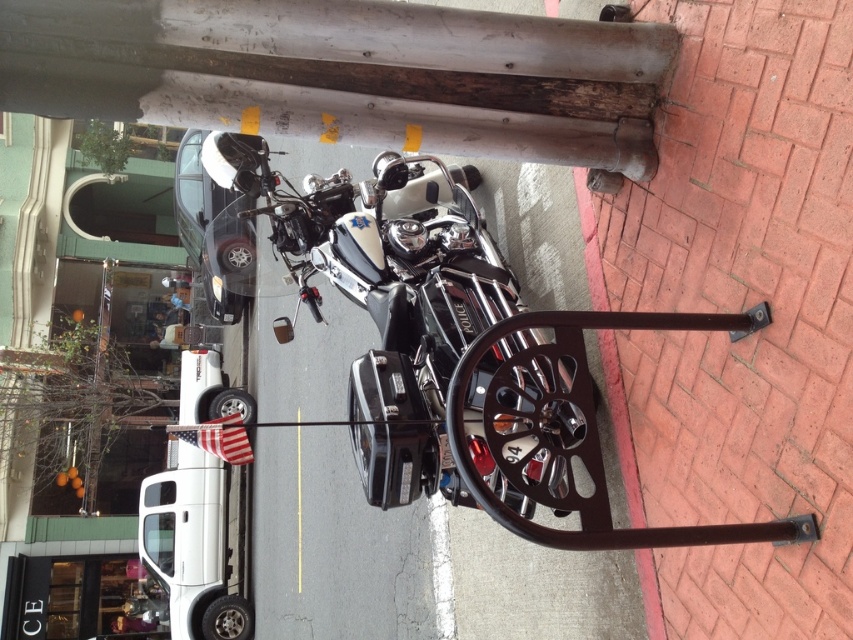
You are standing at the point closest to the motorcycle. Which coordinate point, point A at (x=279, y=237) or point B at (x=627, y=504), is farther away from you?

Point A at (x=279, y=237) is behind point B at (x=627, y=504), so point A is farther away from you.

You are a pedestrian standing on the sidewalk. You see the shiny chrome motorcycle at center and the brick at lower right. Which object is closer to your right side?

The brick at lower right is closer to your right side because it is positioned to the right of the shiny chrome motorcycle at center.

You are a pedestrian standing on the sidewalk and want to cross the street. You see the shiny chrome motorcycle at center and the brick at lower right. Which object is closer to you as you stand on the sidewalk?

The shiny chrome motorcycle at center is closer to you because it is in front of the brick at lower right, meaning the motorcycle is positioned between you and the brick.